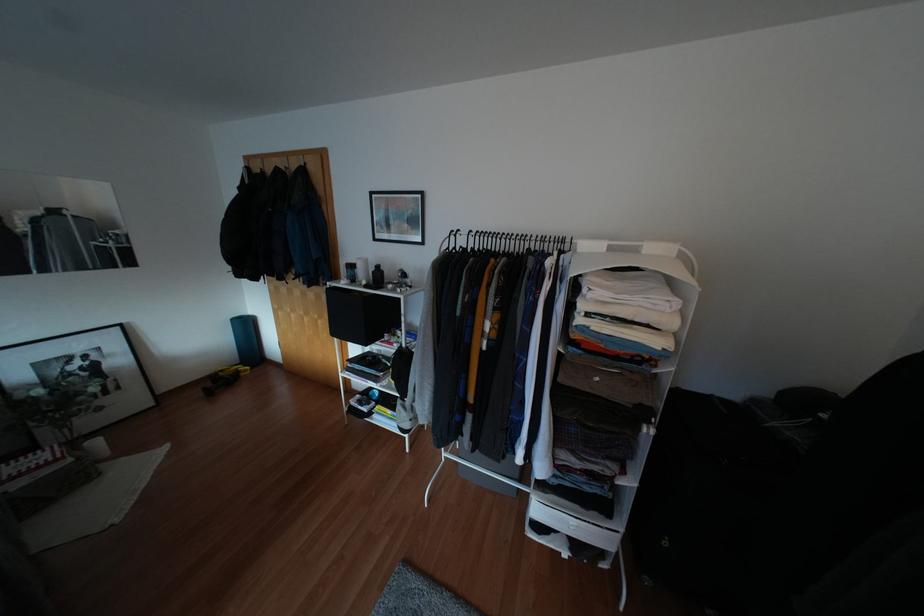
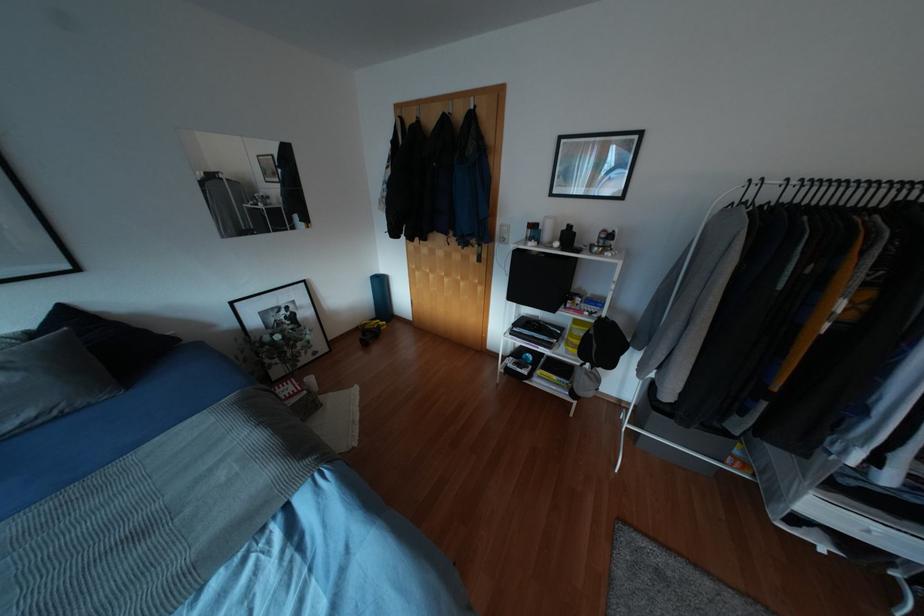
Question: The camera is either moving clockwise (left) or counter-clockwise (right) around the object. The first image is from the beginning of the video and the second image is from the end. Is the camera moving left or right when shooting the video?

Choices:
 (A) Left
 (B) Right

Answer: (B)